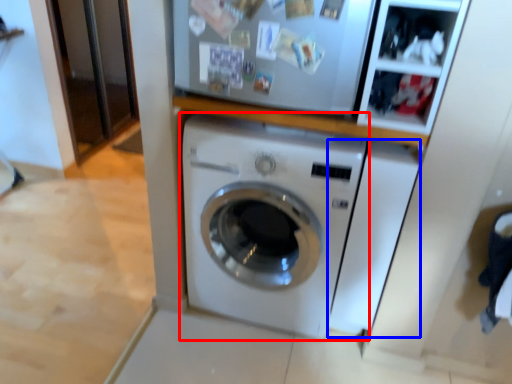
Question: Which object appears closest to the camera in this image, washing machine (highlighted by a red box) or washing machine (highlighted by a blue box)?

Choices:
 (A) washing machine
 (B) washing machine

Answer: (A)